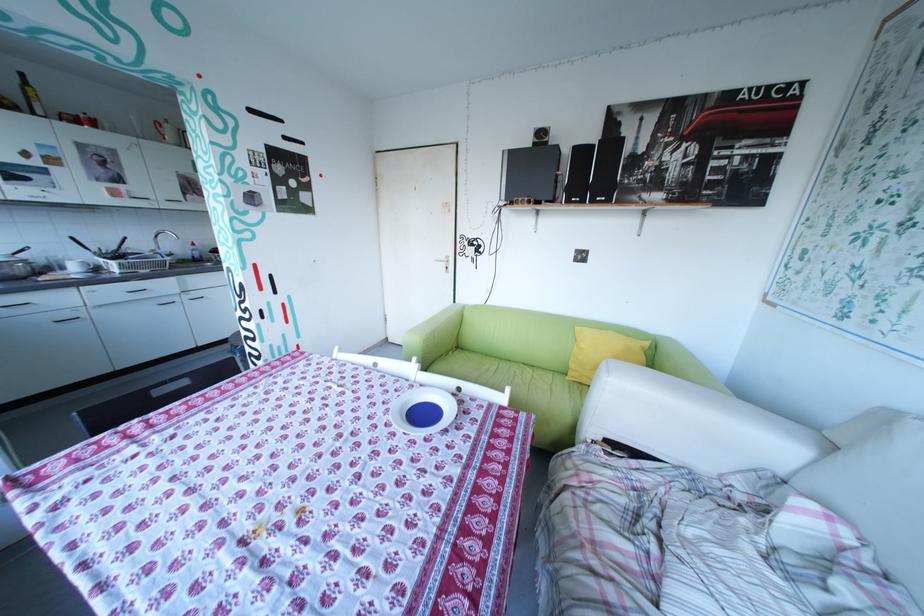
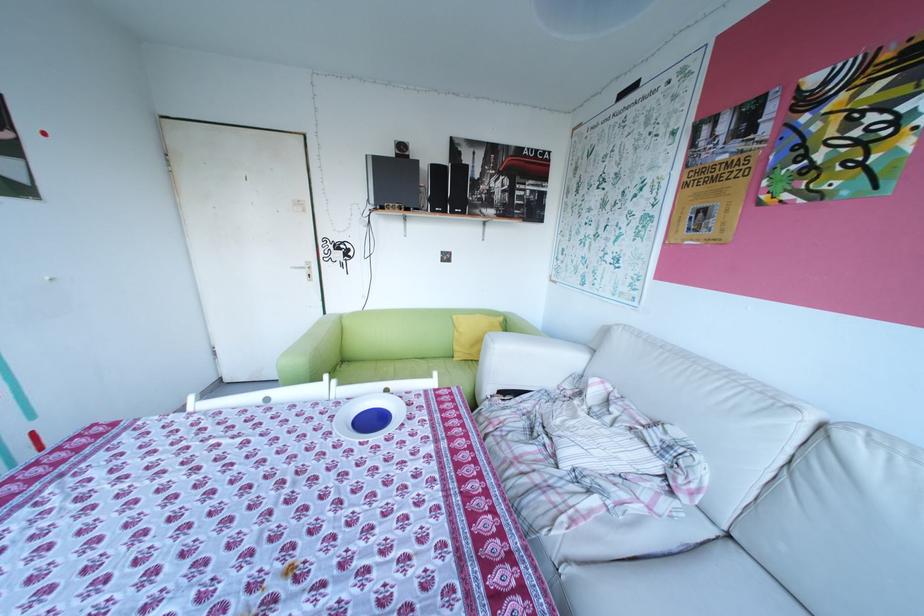
Where in the second image is the point corresponding to [433,386] from the first image?

(360, 399)